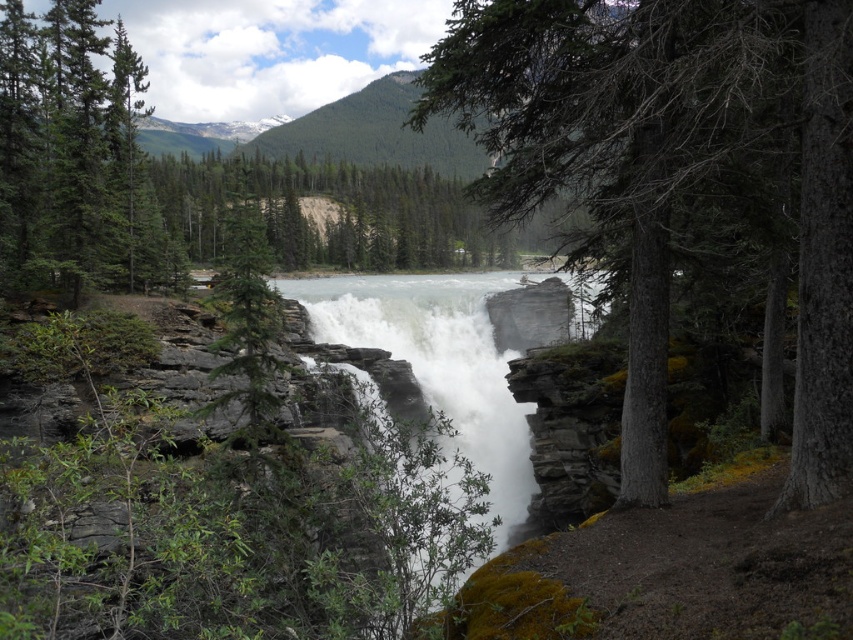
Question: Which point is closer to the camera?

Choices:
 (A) (19, 285)
 (B) (772, 116)
 (C) (277, 280)

Answer: (B)

Question: Can you confirm if green rough bark tree at center is positioned to the left of green matte tree at upper left?

Choices:
 (A) no
 (B) yes

Answer: (A)

Question: Which object is closer to the camera taking this photo?

Choices:
 (A) white frothy water at center
 (B) green matte tree at upper left

Answer: (B)

Question: Does green rough bark tree at center appear on the right side of white frothy water at center?

Choices:
 (A) yes
 (B) no

Answer: (A)

Question: Which point is farther to the camera?

Choices:
 (A) (838, 381)
 (B) (32, 122)
 (C) (474, 385)

Answer: (C)

Question: Can you confirm if green rough bark tree at center is thinner than white frothy water at center?

Choices:
 (A) no
 (B) yes

Answer: (B)